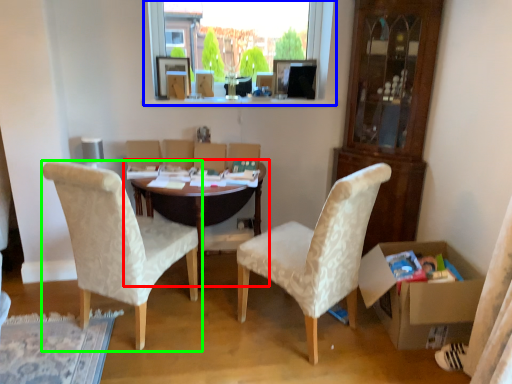
Question: Considering the real-world distances, which object is closest to table (highlighted by a red box)? window (highlighted by a blue box) or chair (highlighted by a green box).

Choices:
 (A) window
 (B) chair

Answer: (B)